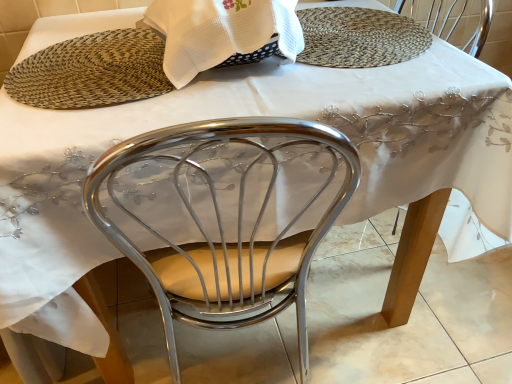
Question: Is woven mat at upper center not within white woven cloth at upper center?

Choices:
 (A) no
 (B) yes

Answer: (B)

Question: Considering the relative sizes of woven mat at upper center and white woven cloth at upper center in the image provided, is woven mat at upper center bigger than white woven cloth at upper center?

Choices:
 (A) no
 (B) yes

Answer: (A)

Question: Is woven mat at upper center facing away from white woven cloth at upper center?

Choices:
 (A) yes
 (B) no

Answer: (B)

Question: Does woven mat at upper center lie in front of white woven cloth at upper center?

Choices:
 (A) no
 (B) yes

Answer: (A)

Question: Is woven mat at upper center to the right of white woven cloth at upper center from the viewer's perspective?

Choices:
 (A) yes
 (B) no

Answer: (B)

Question: Is woven mat at upper center taller than white woven cloth at upper center?

Choices:
 (A) yes
 (B) no

Answer: (B)

Question: Does woven straw placemat at upper center come behind white woven cloth at upper center?

Choices:
 (A) yes
 (B) no

Answer: (A)

Question: From a real-world perspective, is woven straw placemat at upper center on white woven cloth at upper center?

Choices:
 (A) no
 (B) yes

Answer: (A)

Question: Does woven straw placemat at upper center have a smaller size compared to white woven cloth at upper center?

Choices:
 (A) no
 (B) yes

Answer: (B)

Question: Can you confirm if woven straw placemat at upper center is thinner than white woven cloth at upper center?

Choices:
 (A) no
 (B) yes

Answer: (A)

Question: Is woven straw placemat at upper center positioned with its back to white woven cloth at upper center?

Choices:
 (A) no
 (B) yes

Answer: (A)

Question: Is woven straw placemat at upper center positioned beyond the bounds of white woven cloth at upper center?

Choices:
 (A) no
 (B) yes

Answer: (B)

Question: Is the depth of woven straw placemat at upper center greater than that of woven mat at upper center?

Choices:
 (A) no
 (B) yes

Answer: (B)